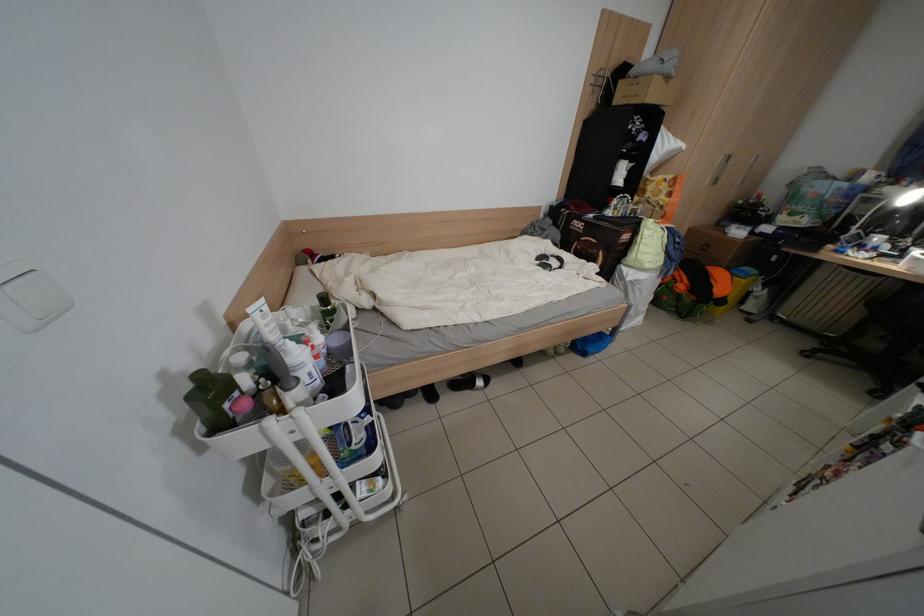
This screenshot has width=924, height=616. I want to click on white cream tube, so click(x=266, y=325).